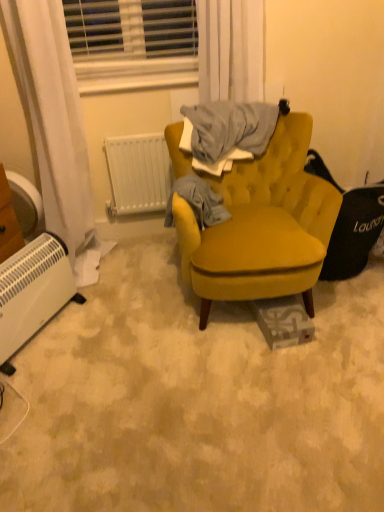
Image resolution: width=384 pixels, height=512 pixels. Find the location of `white plastic blinds at upper center`. white plastic blinds at upper center is located at coordinates (132, 42).

Find the location of `white plastic radiator at center, the 1th radiator when ordered from right to left`. white plastic radiator at center, the 1th radiator when ordered from right to left is located at coordinates click(x=138, y=173).

In order to face white plastic radiator at lower left, positioned as the 1th radiator in left-to-right order, should I rotate leftwards or rightwards?

To align with it, rotate left about 21.249°.

At what (x,y) coordinates should I click in order to perform the action: click on white plastic blinds at upper center. Please return your answer as a coordinate pair (x, y). The image size is (384, 512). Looking at the image, I should click on (132, 42).

This screenshot has width=384, height=512. I want to click on swivel chair on the right side of mustard fabric chair at center, so click(x=350, y=224).

From the image's perspective, which is above, mustard fabric chair at center or velvet mustard swivel chair at right?

velvet mustard swivel chair at right is shown above in the image.

Is mustard fabric chair at center facing away from velvet mustard swivel chair at right?

mustard fabric chair at center does not have its back to velvet mustard swivel chair at right.

From a real-world perspective, which is physically below, mustard fabric chair at center or velvet mustard swivel chair at right?

velvet mustard swivel chair at right.

Does velvet mustard swivel chair at right appear on the right side of white plastic blinds at upper center?

Indeed, velvet mustard swivel chair at right is positioned on the right side of white plastic blinds at upper center.

Based on the photo, is velvet mustard swivel chair at right aimed at white plastic blinds at upper center?

No, velvet mustard swivel chair at right is not turned towards white plastic blinds at upper center.

Do you think velvet mustard swivel chair at right is within white plastic blinds at upper center, or outside of it?

velvet mustard swivel chair at right is not inside white plastic blinds at upper center, it's outside.

Is the depth of velvet mustard swivel chair at right less than that of white plastic radiator at lower left, marked as the first radiator in a bottom-to-top arrangement?

No, velvet mustard swivel chair at right is behind white plastic radiator at lower left, marked as the first radiator in a bottom-to-top arrangement.

How different are the orientations of velvet mustard swivel chair at right and white plastic radiator at lower left, the first radiator positioned from the front, in degrees?

They differ by 57.7 degrees in their facing directions.

Does point (338, 268) appear closer or farther from the camera than point (5, 333)?

Point (338, 268) appears to be farther away from the viewer than point (5, 333).

Can you confirm if velvet mustard swivel chair at right is taller than white plastic radiator at lower left, the 2th radiator positioned from the back?

Indeed, velvet mustard swivel chair at right has a greater height compared to white plastic radiator at lower left, the 2th radiator positioned from the back.

In the scene shown: Is white sheer curtain at upper center far away from gray cotton sweater at center?

white sheer curtain at upper center is actually quite close to gray cotton sweater at center.

From the image's perspective, is white sheer curtain at upper center below gray cotton sweater at center?

No.

You are a GUI agent. You are given a task and a screenshot of the screen. Output one action in this format:
    pyautogui.click(x=<x>, y=<y>)
    Task: Click on the curtain on the right side of gray cotton sweater at center
    
    Given the screenshot: What is the action you would take?
    pyautogui.click(x=230, y=49)

Is white sheer curtain at upper center looking in the opposite direction of gray cotton sweater at center?

That's not correct — white sheer curtain at upper center is not looking away from gray cotton sweater at center.

Considering the points (223, 213) and (20, 259), which point is in front, point (223, 213) or point (20, 259)?

The point (20, 259) is closer.

From the image's perspective, is gray cotton sweater at center above or below white plastic radiator at lower left, positioned as the 1th radiator in left-to-right order?

gray cotton sweater at center is above white plastic radiator at lower left, positioned as the 1th radiator in left-to-right order.

Looking at this image, from a real-world perspective, which object stands above the other?

gray cotton sweater at center is physically above.

Considering the positions of points (211, 218) and (278, 261), is point (211, 218) closer to camera compared to point (278, 261)?

No, (211, 218) is behind (278, 261).

Considering the sizes of objects gray cotton sweater at center and mustard fabric chair at center in the image provided, who is taller, gray cotton sweater at center or mustard fabric chair at center?

With more height is mustard fabric chair at center.

From the image's perspective, is gray cotton sweater at center positioned above or below mustard fabric chair at center?

From the image's perspective, gray cotton sweater at center appears above mustard fabric chair at center.

Is gray cotton sweater at center further to camera compared to mustard fabric chair at center?

Yes, it is.

Is gray cotton sweater at center at the right side of white plastic radiator at center, placed as the second radiator when sorted from left to right?

Correct, you'll find gray cotton sweater at center to the right of white plastic radiator at center, placed as the second radiator when sorted from left to right.

Is gray cotton sweater at center positioned with its back to white plastic radiator at center, positioned as the 2th radiator in bottom-to-top order?

Yes, white plastic radiator at center, positioned as the 2th radiator in bottom-to-top order, is at the back of gray cotton sweater at center.

You are a GUI agent. You are given a task and a screenshot of the screen. Output one action in this format:
    pyautogui.click(x=<x>, y=<y>)
    Task: Click on the clothing on the right of white plastic radiator at center, which ranks as the second radiator in front-to-back order
    The height and width of the screenshot is (512, 384).
    Given the screenshot: What is the action you would take?
    pyautogui.click(x=198, y=201)

Which of these two, gray cotton sweater at center or white plastic radiator at center, positioned as the 2th radiator in bottom-to-top order, is thinner?

With smaller width is white plastic radiator at center, positioned as the 2th radiator in bottom-to-top order.

Where is `chair on the left side of velvet mustard swivel chair at right`? Image resolution: width=384 pixels, height=512 pixels. chair on the left side of velvet mustard swivel chair at right is located at coordinates (262, 226).

This screenshot has width=384, height=512. Identify the location of swivel chair lying on the right of white plastic blinds at upper center. (350, 224).

When comparing their distances from white plastic blinds at upper center, does white plastic radiator at lower left, positioned as the 1th radiator in left-to-right order, or white plastic radiator at center, placed as the second radiator when sorted from left to right, seem further?

Among the two, white plastic radiator at lower left, positioned as the 1th radiator in left-to-right order, is located further to white plastic blinds at upper center.

From the image, which object appears to be nearer to white sheer curtain at upper center, white plastic blinds at upper center or mustard fabric chair at center?

Among the two, white plastic blinds at upper center is located nearer to white sheer curtain at upper center.

From the image, which object appears to be nearer to gray cotton sweater at center, velvet mustard swivel chair at right or white sheer curtain at upper center?

velvet mustard swivel chair at right lies closer to gray cotton sweater at center than the other object.

Considering their positions, is white plastic radiator at center, which is the first radiator in back-to-front order, positioned closer to white plastic blinds at upper center than gray cotton sweater at center?

The object closer to white plastic blinds at upper center is white plastic radiator at center, which is the first radiator in back-to-front order.

Looking at the image, which one is located further to white sheer curtain at upper center, white plastic radiator at center, placed as the second radiator when sorted from left to right, or mustard fabric chair at center?

white plastic radiator at center, placed as the second radiator when sorted from left to right, lies further to white sheer curtain at upper center than the other object.

When comparing their distances from white sheer curtain at upper center, does white plastic blinds at upper center or gray cotton sweater at center seem closer?

Among the two, white plastic blinds at upper center is located nearer to white sheer curtain at upper center.

Considering their positions, is gray cotton sweater at center positioned further to velvet mustard swivel chair at right than white plastic blinds at upper center?

white plastic blinds at upper center is further to velvet mustard swivel chair at right.

Based on their spatial positions, is white sheer curtain at upper center or white plastic radiator at center, which is the first radiator in back-to-front order, further from velvet mustard swivel chair at right?

Among the two, white plastic radiator at center, which is the first radiator in back-to-front order, is located further to velvet mustard swivel chair at right.

Find the location of a particular element. clothing between white plastic radiator at lower left, marked as the first radiator in a bottom-to-top arrangement, and mustard fabric chair at center, in the horizontal direction is located at coordinates (198, 201).

Find the location of a particular element. The image size is (384, 512). chair between white sheer curtain at upper center and white plastic radiator at lower left, the 2th radiator positioned from the back, vertically is located at coordinates (262, 226).

Where is `radiator between white sheer curtain at upper center and mustard fabric chair at center in the vertical direction`? radiator between white sheer curtain at upper center and mustard fabric chair at center in the vertical direction is located at coordinates (138, 173).

The width and height of the screenshot is (384, 512). In order to click on radiator between white plastic blinds at upper center and gray cotton sweater at center in the up-down direction in this screenshot , I will do `click(138, 173)`.